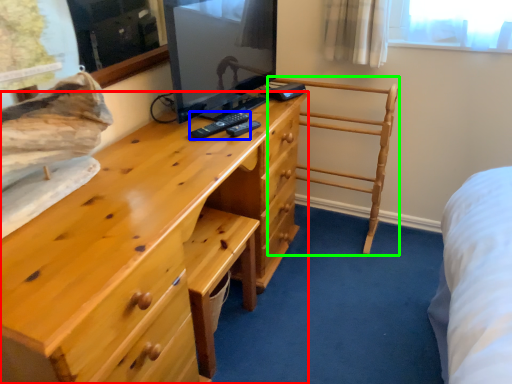
Question: Estimate the real-world distances between objects in this image. Which object is closer to chest of drawers (highlighted by a red box), remote (highlighted by a blue box) or furniture (highlighted by a green box)?

Choices:
 (A) remote
 (B) furniture

Answer: (A)